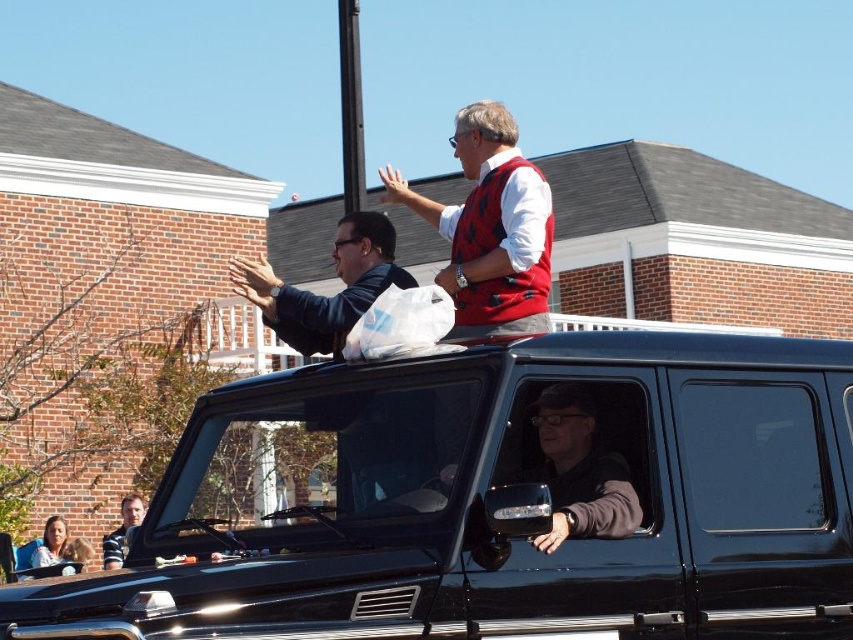
You are a photographer at the parade and want to capture both the matte red vest at upper center and the matte black jacket at upper left in a single frame. Which object should you focus on first to ensure both are in the frame?

You should focus on the matte red vest at upper center first because it is bigger than the matte black jacket at upper left, so centering on it will ensure both are captured in the frame.

You are a photographer standing at the edge of the parade route. You want to take a photo of both the matte red vest at upper center and the matte black jacket at center. If your camera has a maximum focus range of 20 feet, will you be able to capture both subjects in focus?

The distance between the matte red vest at upper center and the matte black jacket at center is 19.97 feet, which is within the camera s maximum focus range of 20 feet. Therefore, you can capture both subjects in focus.